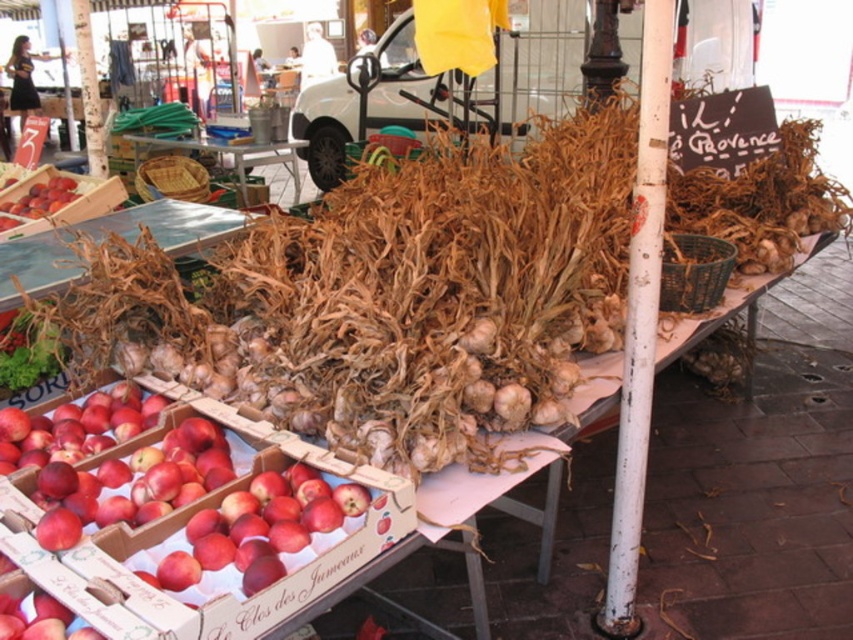
Question: Based on their relative distances, which object is nearer to the red matte peach box at center?

Choices:
 (A) woven wood basket at center
 (B) green leafy vegetable at lower left

Answer: (B)

Question: Which of the following is the farthest from the observer?

Choices:
 (A) (45, 208)
 (B) (408, 529)
 (C) (223, 150)
 (D) (219, 550)

Answer: (C)

Question: Which point is closer to the camera?

Choices:
 (A) (151, 483)
 (B) (91, 426)

Answer: (A)

Question: Is shiny red apples at lower left closer to the viewer compared to green fabric at upper left?

Choices:
 (A) no
 (B) yes

Answer: (B)

Question: Does red matte peach box at center appear on the left side of shiny red apples at left?

Choices:
 (A) yes
 (B) no

Answer: (B)

Question: Does red matte peach box at center appear on the left side of red matte apples at lower left?

Choices:
 (A) yes
 (B) no

Answer: (A)